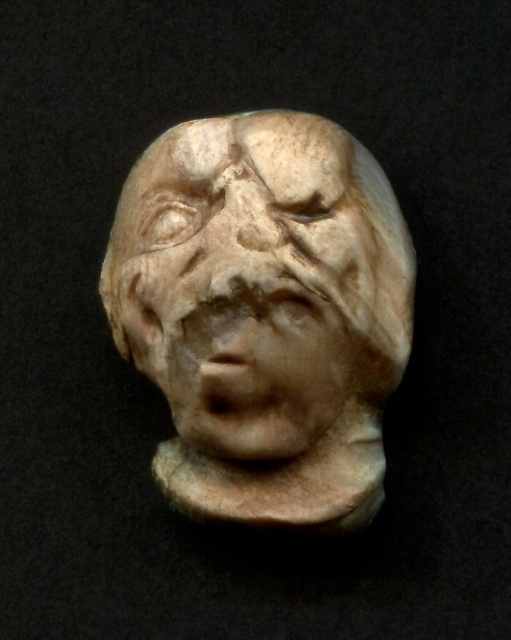
From the picture: Is white marble head at center below white marble face at center?

Indeed, white marble head at center is positioned under white marble face at center.

Who is lower down, white marble head at center or white marble face at center?

Positioned lower is white marble head at center.

Locate an element on the screen. The height and width of the screenshot is (640, 511). white marble head at center is located at coordinates (265, 314).